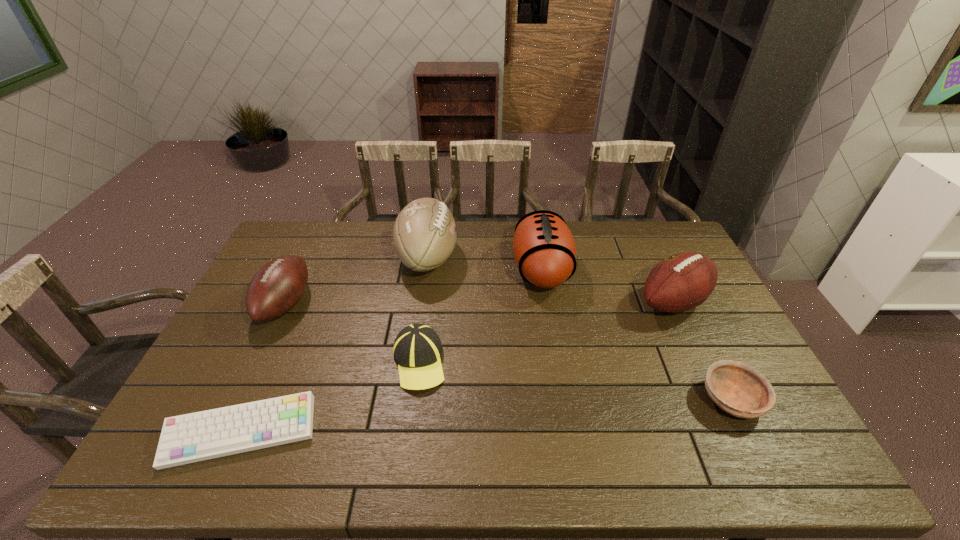
Identify which football (American) is located as the nearest to the fourth shortest object. Please provide its 2D coordinates. Your answer should be formatted as a tuple, i.e. [(x, y)], where the tuple contains the x and y coordinates of a point satisfying the conditions above.

[(424, 235)]

I want to click on free spot that satisfies the following two spatial constraints: 1. on the back side of the second football (American) from right to left; 2. on the left side of the shortest football (American), so click(301, 269).

Identify the location of blank space that satisfies the following two spatial constraints: 1. on the laces of the second football (American) from left to right; 2. on the front side of the fourth shortest object. Image resolution: width=960 pixels, height=540 pixels. (421, 304).

Locate an element on the screen. The width and height of the screenshot is (960, 540). free space that satisfies the following two spatial constraints: 1. on the laces of the second football (American) from left to right; 2. on the right side of the second shortest object is located at coordinates (407, 400).